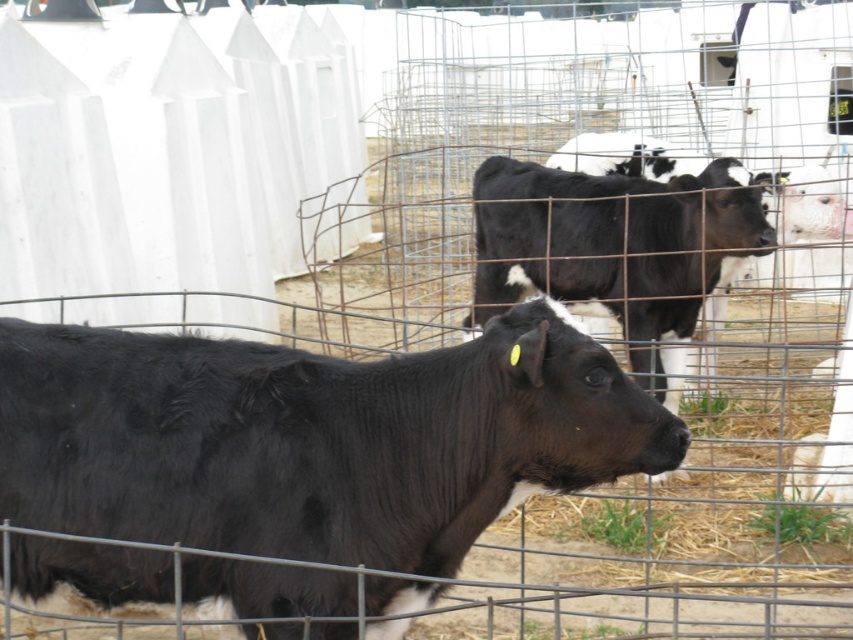
You are a farmer checking the cows in the enclosure. You see the black glossy cow at center and the black smooth cow at center. Which one is more to the left?

The black glossy cow at center is more to the left since it is positioned on the left side of the black smooth cow at center.

You are standing at the center of the fenced enclosure and see the point marked at coordinates (312, 438). What animal is located exactly at that point?

The black glossy cow at center is located exactly at point (312, 438).

You are a farmer who needs to separate two cows using a divider that is 3 meters wide. You see the black glossy cow at center and the black smooth cow at center. Can the divider fit between them to separate them?

The distance between the black glossy cow at center and the black smooth cow at center is 3.33 meters, so the divider that is 3 meters wide can fit between them to separate them since it is narrower than the gap.